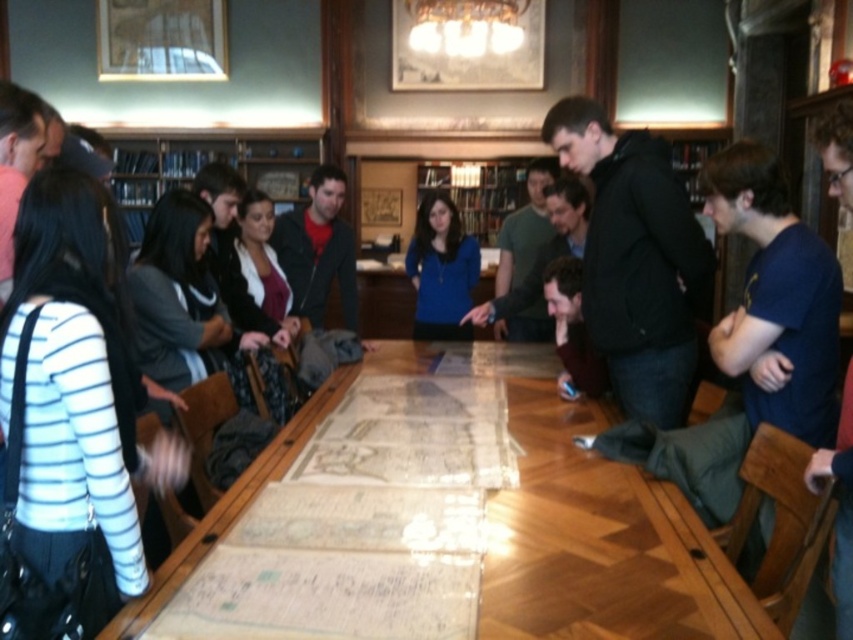
Can you confirm if blue fabric bookshelf at upper center is wider than blue matte sweater at center?

Indeed, blue fabric bookshelf at upper center has a greater width compared to blue matte sweater at center.

I want to click on blue fabric bookshelf at upper center, so click(201, 168).

Where is `blue fabric bookshelf at upper center`? blue fabric bookshelf at upper center is located at coordinates (201, 168).

Is wooden map at center to the right of blue matte sweater at center from the viewer's perspective?

Indeed, wooden map at center is positioned on the right side of blue matte sweater at center.

Does wooden map at center appear under blue matte sweater at center?

Indeed, wooden map at center is positioned under blue matte sweater at center.

Between point (659, 627) and point (460, 312), which one is positioned behind?

Positioned behind is point (460, 312).

The height and width of the screenshot is (640, 853). Find the location of `wooden map at center`. wooden map at center is located at coordinates (601, 544).

Between wooden map at center and blue fabric bookshelf at upper center, which one has less height?

With less height is wooden map at center.

Is point (628, 484) more distant than point (125, 198)?

No, it is in front of (125, 198).

Is point (515, 609) positioned in front of point (300, 176)?

That is True.

Locate an element on the screen. wooden map at center is located at coordinates 601,544.